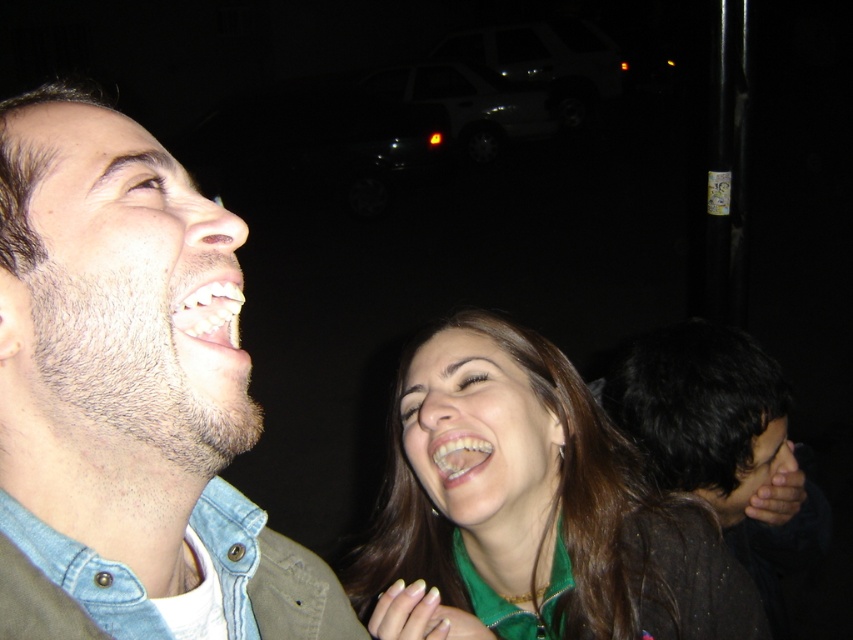
You are standing in front of the image and want to determine which of the two points, point (817,531) or point (461,456), is closer to you. Based on the scene description, which point is nearer?

Point (817,531) is closer to you because it is further to the viewer than point (461,456).

You are a photographer trying to capture a candid shot of the two people in the foreground. You want to ensure both the shiny brown hair at lower right and the white glossy teeth at lower left are clearly visible in your frame. Based on their positions, which one should you focus on first to ensure they are both in focus?

Since the shiny brown hair at lower right is to the right of white glossy teeth at lower left, you should focus on the white glossy teeth at lower left first as it is closer to the camera, ensuring both are in focus.

You are a photographer trying to capture a candid shot of the two people laughing in the foreground. You need to position your camera so that the dark brown hair at lower right and the white glossy teeth at lower left are both in focus. Which object should you focus on first to ensure both are sharp?

You should focus on the white glossy teeth at lower left first because it is closer to the camera than the dark brown hair at lower right. By focusing on the closer object, the depth of field will extend to include the farther object, ensuring both are in focus.